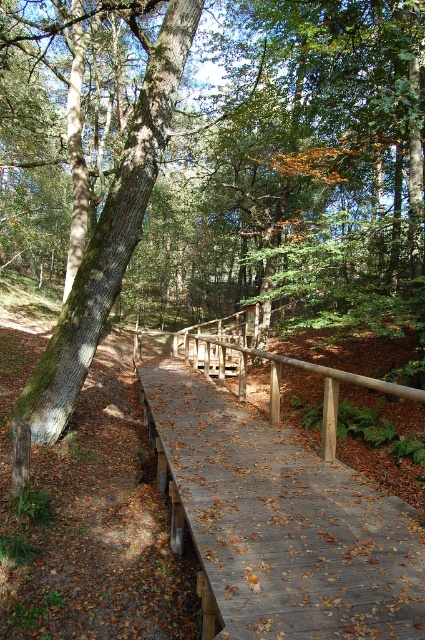
Who is positioned more to the right, green mossy tree at left or brown wooden rail at center?

Positioned to the right is brown wooden rail at center.

Between point (65, 332) and point (331, 458), which one is positioned in front?

Point (331, 458) is in front.

Where is `green mossy tree at left`? green mossy tree at left is located at coordinates (110, 234).

Can you confirm if wooden bridge at center is thinner than brown wooden rail at center?

Correct, wooden bridge at center's width is less than brown wooden rail at center's.

Does wooden bridge at center lie behind brown wooden rail at center?

Yes, it is.

Where is `wooden bridge at center`? This screenshot has height=640, width=425. wooden bridge at center is located at coordinates (283, 522).

Between point (413, 573) and point (201, 12), which one is positioned behind?

Positioned behind is point (201, 12).

Between point (269, 634) and point (190, 12), which one is positioned in front?

Positioned in front is point (269, 634).

Locate an element on the screen. The width and height of the screenshot is (425, 640). wooden bridge at center is located at coordinates (283, 522).